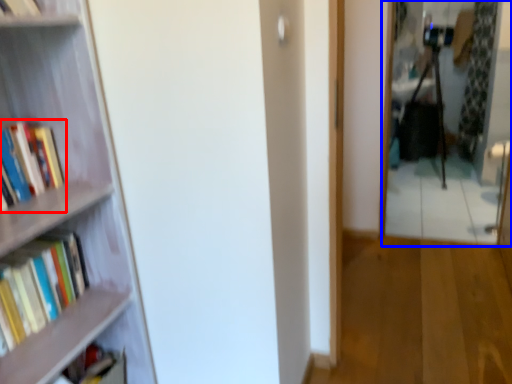
Question: Which object is closer to the camera taking this photo, book (highlighted by a red box) or mirror (highlighted by a blue box)?

Choices:
 (A) book
 (B) mirror

Answer: (A)